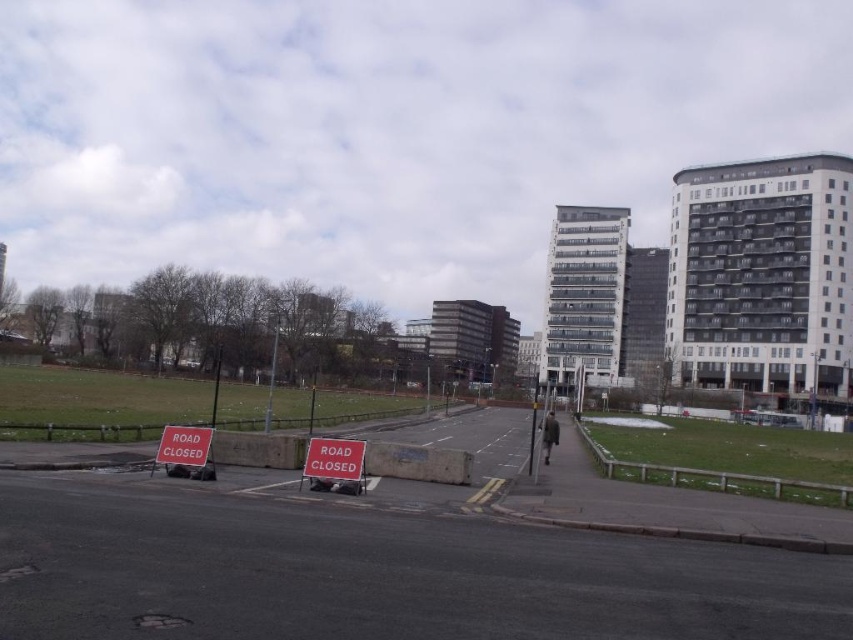
Describe the element at coordinates (334, 458) in the screenshot. I see `red plastic sign at center` at that location.

Who is lower down, red plastic sign at center or red plastic sign at lower left?

red plastic sign at lower left is below.

Between point (343, 474) and point (183, 445), which one is positioned behind?

The point (183, 445) is behind.

The image size is (853, 640). What are the coordinates of `red plastic sign at center` in the screenshot? It's located at (334, 458).